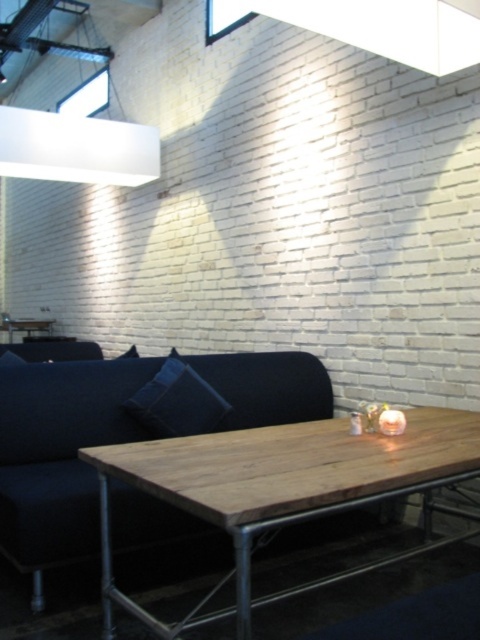
You are arranging a photo shoot in this room and need to place a model between the white matte rectangular light fixture at upper left and the dark blue fabric pillow at center. Based on their positions, which object should the model stand closer to if they want to be centered between them?

The model should stand closer to the dark blue fabric pillow at center because the white matte rectangular light fixture at upper left is positioned on the left side of the dark blue fabric pillow at center, meaning the center point between them is closer to the pillow.

You are standing in the center of the room and want to install a new light fixture. The current white matte rectangular light fixture at upper left is at position coordinates 0.233 on the x and 0.160 on the y. If you want to place the new fixture directly below the existing one, what coordinates should you aim for?

The white matte rectangular light fixture at upper left is located at point (76, 148). To place the new fixture directly below it, you should aim for the same x coordinate of 0.233 and a lower y coordinate, such as 0.160 minus the desired distance downward. However, without specific distance details, the exact coordinates cannot be determined precisely. The answer should reflect the need to maintain the same x value and decrease the y value accordingly.